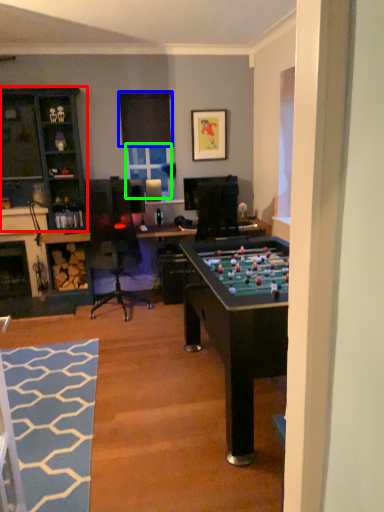
Question: Considering the real-world distances, which object is closest to cabinetry (highlighted by a red box)? window screen (highlighted by a blue box) or window screen (highlighted by a green box).

Choices:
 (A) window screen
 (B) window screen

Answer: (A)